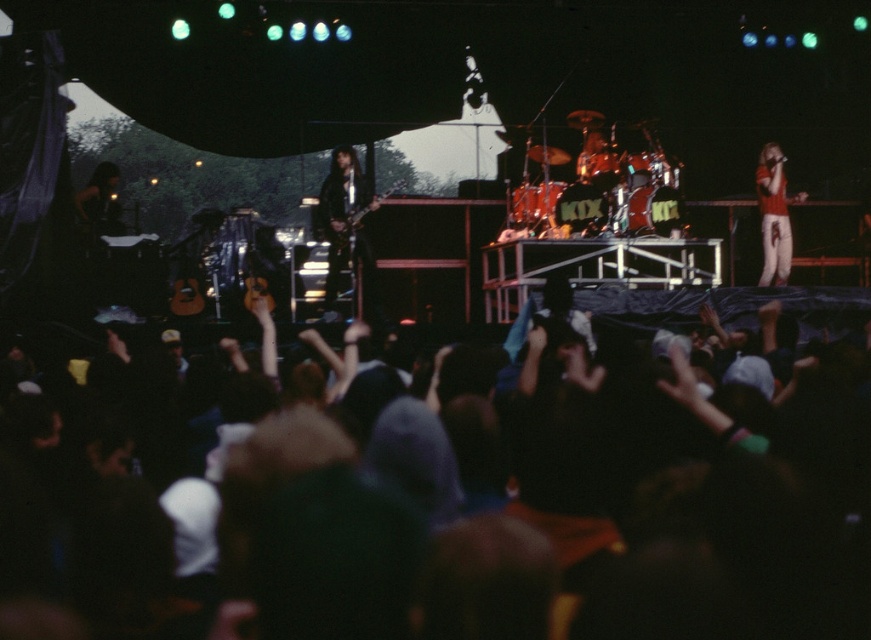
In the scene shown: Who is positioned more to the right, shiny red drum set at center or red matte shirt at right?

red matte shirt at right

Which is in front, point (552, 154) or point (781, 179)?

Point (552, 154) is more forward.

Who is more forward, (528, 211) or (765, 230)?

Point (528, 211) is in front.

Image resolution: width=871 pixels, height=640 pixels. Identify the location of shiny red drum set at center. (605, 188).

Who is more forward, (608,166) or (354,204)?

Positioned in front is point (608,166).

Can you confirm if shiny red drum set at center is shorter than black leather guitar at center?

Correct, shiny red drum set at center is not as tall as black leather guitar at center.

The image size is (871, 640). In order to click on shiny red drum set at center in this screenshot , I will do `click(605, 188)`.

Who is positioned more to the right, black fabric crowd at lower center or shiny red drum set at center?

From the viewer's perspective, shiny red drum set at center appears more on the right side.

Which of these two, black fabric crowd at lower center or shiny red drum set at center, stands taller?

shiny red drum set at center

Between point (576, 580) and point (626, 179), which one is positioned behind?

Point (626, 179)

You are a GUI agent. You are given a task and a screenshot of the screen. Output one action in this format:
    pyautogui.click(x=<x>, y=<y>)
    Task: Click on the black fabric crowd at lower center
    The width and height of the screenshot is (871, 640).
    Given the screenshot: What is the action you would take?
    pyautogui.click(x=685, y=513)